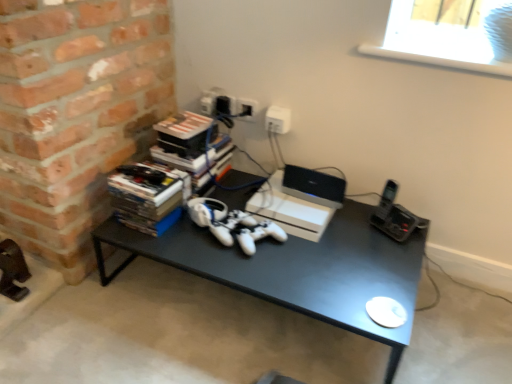
Question: Is point (269, 117) positioned closer to the camera than point (473, 16)?

Choices:
 (A) closer
 (B) farther

Answer: (A)

Question: Is white plastic electric outlet at upper center spatially inside white plastic window screen at upper right, or outside of it?

Choices:
 (A) outside
 (B) inside

Answer: (A)

Question: Based on their relative distances, which object is farther from the white matte gaming console at center?

Choices:
 (A) hardcover books at left
 (B) white plastic electric outlet at upper center
 (C) white plastic window screen at upper right
 (D) black matte desk at center
 (E) white plastic laptop at center

Answer: (C)

Question: Which object is the farthest from the white matte gaming console at center?

Choices:
 (A) black matte desk at center
 (B) white plastic window screen at upper right
 (C) white plastic electric outlet at upper center
 (D) hardcover books at left
 (E) white plastic laptop at center

Answer: (B)